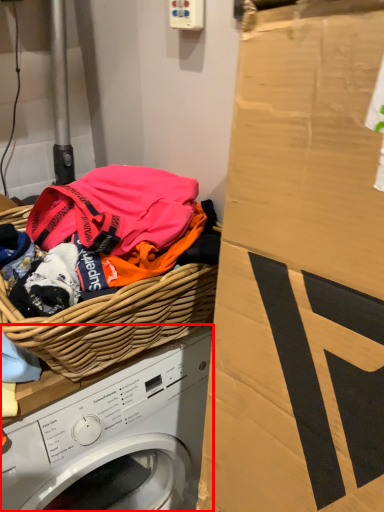
Question: From the image's perspective, where is washing machine (annotated by the red box) located relative to basket?

Choices:
 (A) above
 (B) below

Answer: (B)